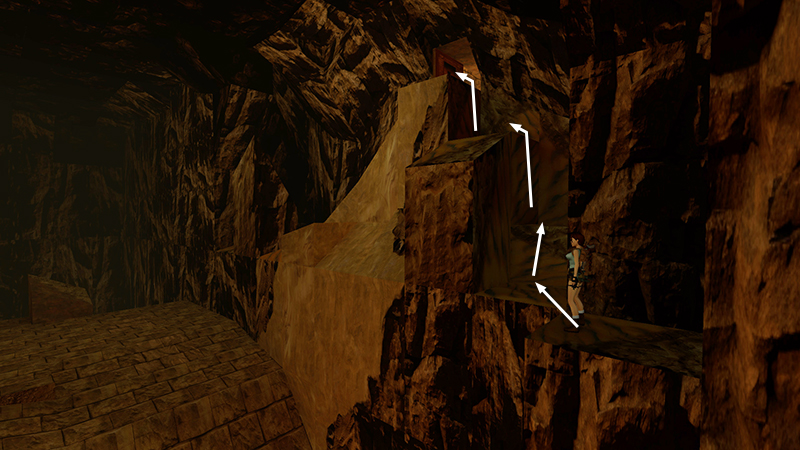
Locate an element on the screen. The height and width of the screenshot is (450, 800). door is located at coordinates (448, 65).